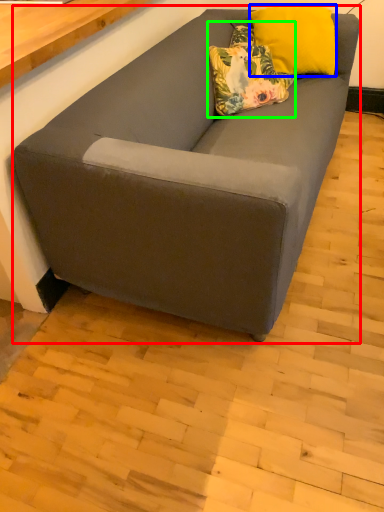
Question: Which object is the farthest from studio couch (highlighted by a red box)? Choose among these: pillow (highlighted by a blue box) or pillow (highlighted by a green box).

Choices:
 (A) pillow
 (B) pillow

Answer: (A)